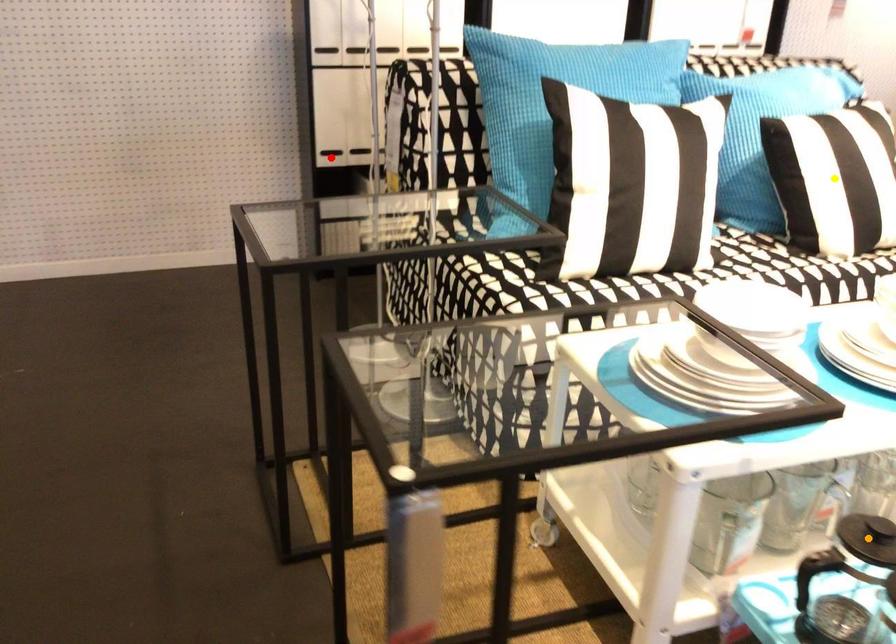
Order these from nearest to farthest:
1. orange point
2. yellow point
3. red point

orange point
yellow point
red point